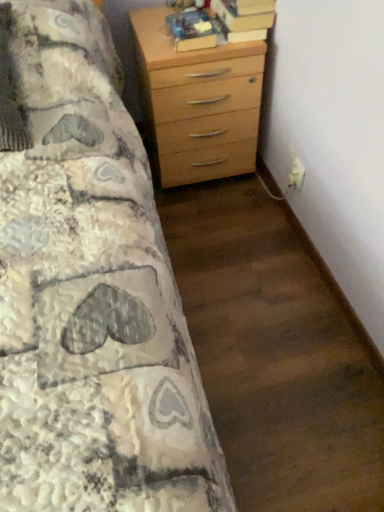
Question: Is hardcover book at upper center, marked as the second book in a right-to-left arrangement, in front of or behind hardcover book at upper right, placed as the 1th book when sorted from right to left, in the image?

Choices:
 (A) behind
 (B) front

Answer: (B)

Question: Is hardcover book at upper center, marked as the second book in a right-to-left arrangement, situated inside hardcover book at upper right, placed as the 1th book when sorted from right to left, or outside?

Choices:
 (A) inside
 (B) outside

Answer: (B)

Question: Which object is the farthest from the hardcover book at upper right, placed as the 1th book when sorted from right to left?

Choices:
 (A) light wood chest of drawers at upper right
 (B) hardcover book at upper center, marked as the second book in a right-to-left arrangement

Answer: (A)

Question: Which of these objects is positioned closest to the hardcover book at upper right, the 2th book positioned from the left?

Choices:
 (A) light wood chest of drawers at upper right
 (B) hardcover book at upper center, which ranks as the 1th book in left-to-right order

Answer: (B)